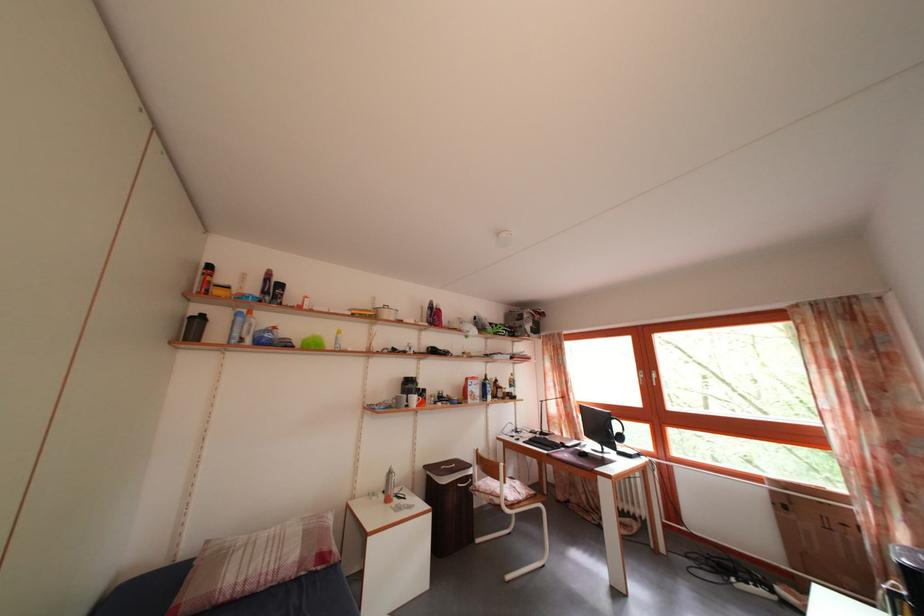
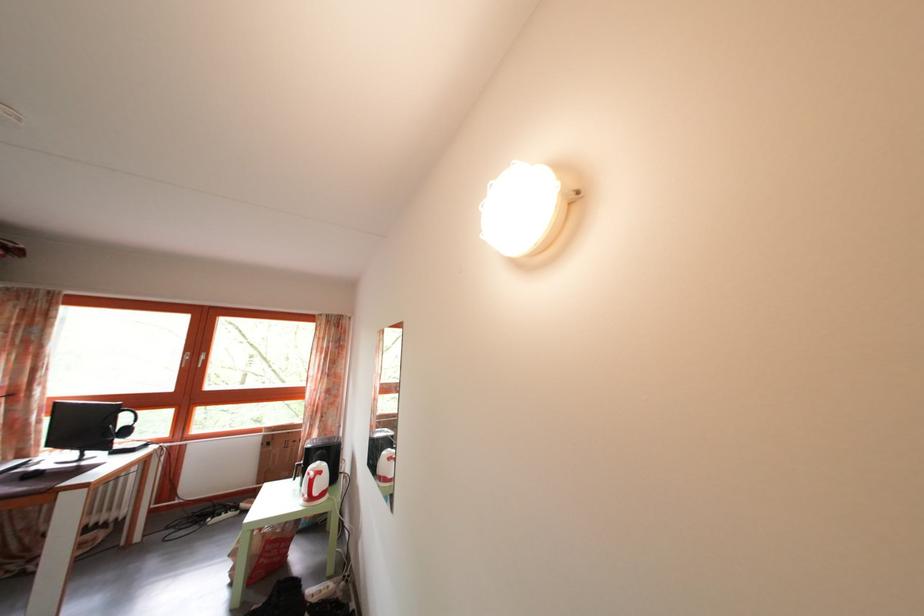
In the second image, find the point that corresponds to pixel 627 454 in the first image.

(128, 451)